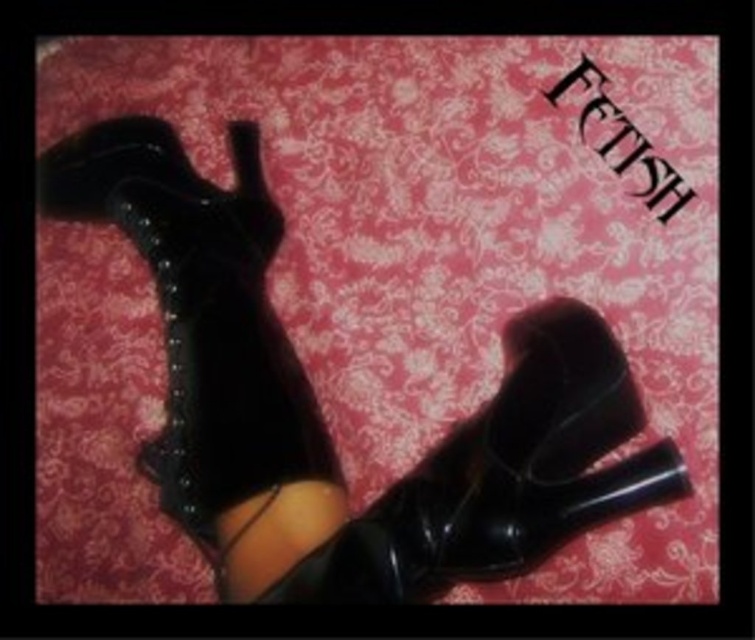
You are a photographer setting up a shoot with the two pairs of boots. You want to ensure that both pairs are visible in the final image. Based on their current positions, will the black patent leather boot at center be fully visible behind the shiny patent leather boots at lower right?

The shiny patent leather boots at lower right is positioned over the black patent leather boot at center, so the black patent leather boot at center will not be fully visible behind the shiny patent leather boots at lower right.

You are a photographer adjusting the lighting for a shoot. The image shows shiny patent leather boots at lower right. Where exactly should you position your light source to ensure the boots are well lit?

The shiny patent leather boots at lower right are located at point (319, 408). To ensure proper lighting, position the light source opposite to the direction of the shadows cast by the boots in the image.

You are a photographer setting up a shoot with two pairs of boots. You have the leather studded boots at left and the black patent leather boot at center. You want to place a small decorative item between them so it appears centered in the photo. Based on their positions, where should you position the item?

The leather studded boots at left is further to the viewer than the black patent leather boot at center. To make the decorative item appear centered, place it closer to the black patent leather boot at center since it is farther away, balancing their distances from the camera.